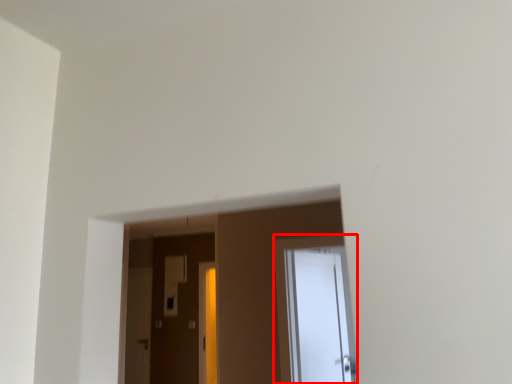
Question: From the image, what is the correct spatial relationship of door (annotated by the red box) in relation to screen door?

Choices:
 (A) left
 (B) right

Answer: (B)